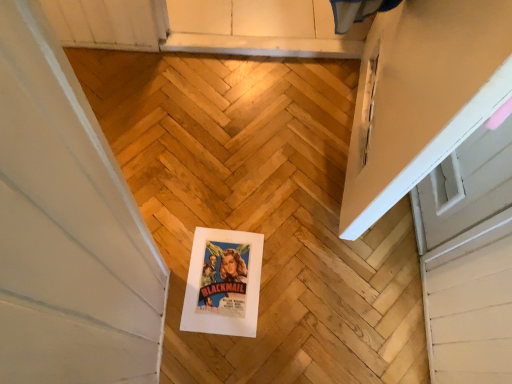
This screenshot has height=384, width=512. I want to click on free space to the back side of matte paper poster at center, so click(244, 208).